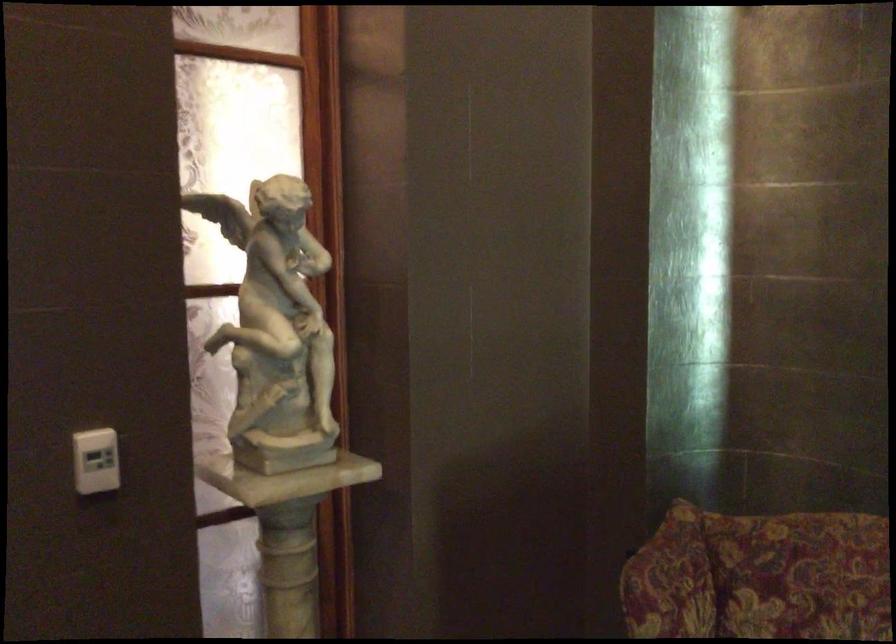
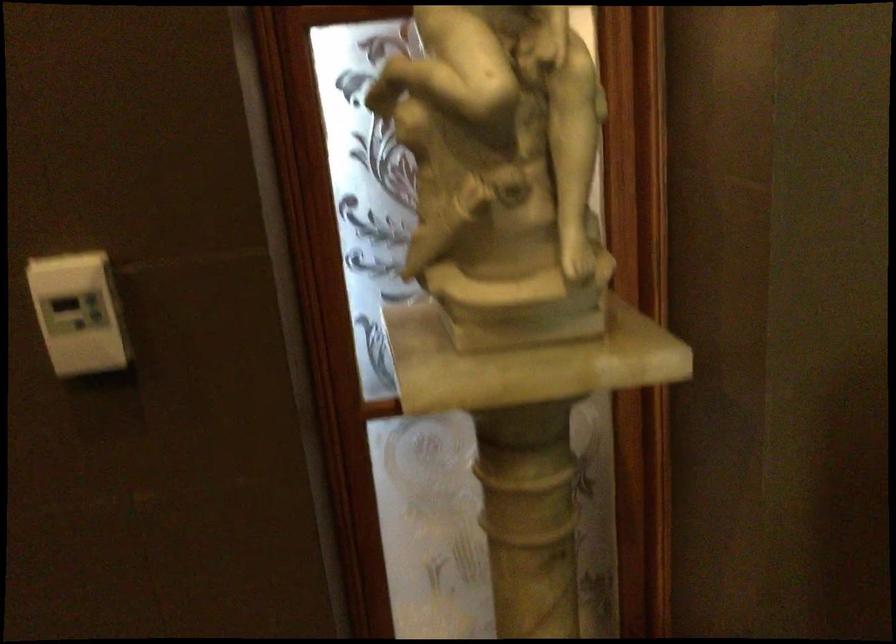
Question: The first image is from the beginning of the video and the second image is from the end. How did the camera likely rotate when shooting the video?

Choices:
 (A) Left
 (B) Right
 (C) Up
 (D) Down

Answer: (A)